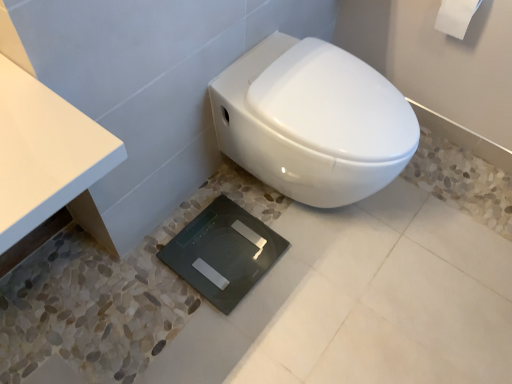
Find the location of a particular element. vacant space to the right of black glass scale at center is located at coordinates (311, 269).